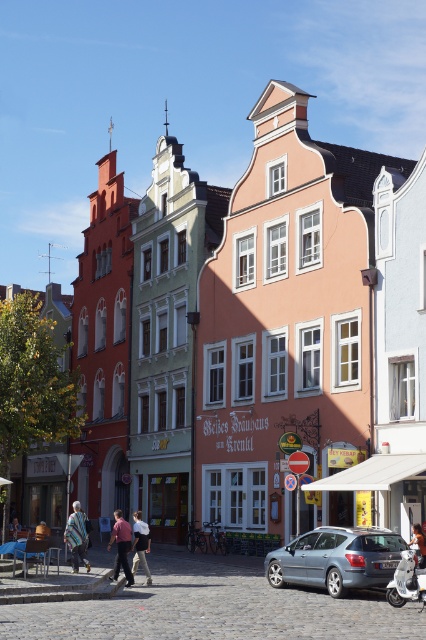
Between pink fabric shirt at center and light brown leather jacket at center, which one has less height?

Standing shorter between the two is light brown leather jacket at center.

Between pink fabric shirt at center and light brown leather jacket at center, which one is positioned higher?

pink fabric shirt at center is higher up.

Where is `pink fabric shirt at center`? pink fabric shirt at center is located at coordinates (120, 545).

Who is positioned more to the left, metallic silver hatchback at lower center or dark brown leather jacket at center?

metallic silver hatchback at lower center is more to the left.

Which is behind, point (397, 548) or point (409, 540)?

The point (409, 540) is behind.

This screenshot has width=426, height=640. What are the coordinates of `metallic silver hatchback at lower center` in the screenshot? It's located at (336, 557).

Between point (135, 515) and point (14, 522), which one is positioned behind?

The point (14, 522) is more distant.

Between point (134, 538) and point (16, 531), which one is positioned behind?

The point (16, 531) is more distant.

Locate an element on the screen. white cotton shirt at center is located at coordinates (141, 545).